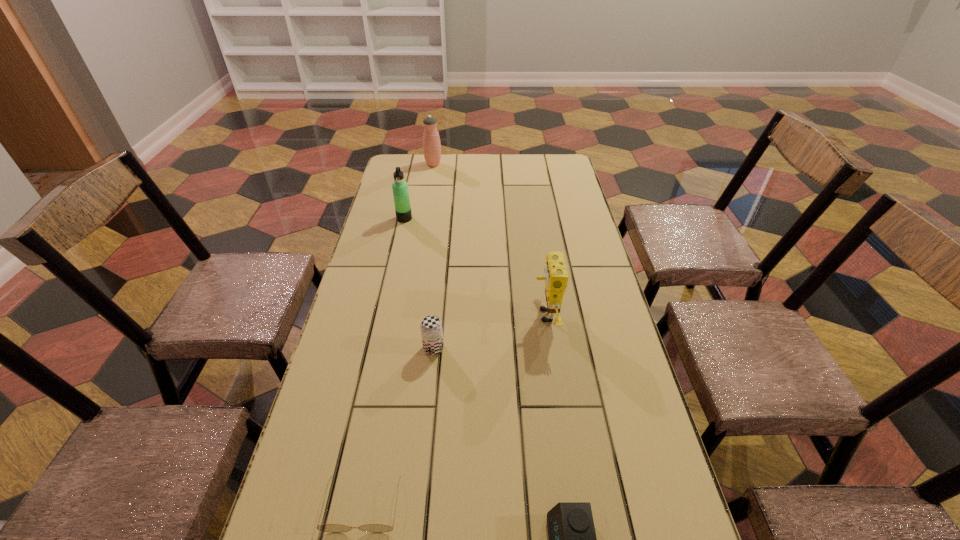
Identify the location of the right thermos bottle. The width and height of the screenshot is (960, 540). click(x=431, y=141).

The height and width of the screenshot is (540, 960). I want to click on the farther thermos bottle, so click(431, 141).

This screenshot has height=540, width=960. Identify the location of the left thermos bottle. (400, 188).

At what (x,y) coordinates should I click in order to perform the action: click on the second farthest object. Please return your answer as a coordinate pair (x, y). Looking at the image, I should click on (400, 188).

Identify the location of sponge. (556, 280).

What are the coordinates of `beer can` in the screenshot? It's located at (431, 326).

Where is `the fourth object from left to right`? This screenshot has width=960, height=540. the fourth object from left to right is located at coordinates (431, 326).

At what (x,y) coordinates should I click in order to perform the action: click on the shortest object. Please return your answer as a coordinate pair (x, y). The image size is (960, 540). Looking at the image, I should click on (332, 528).

Where is `vacant space located 0.170m on the front of the farther thermos bottle`? The height and width of the screenshot is (540, 960). vacant space located 0.170m on the front of the farther thermos bottle is located at coordinates (429, 189).

Find the location of `vacant space positioned on the front of the left thermos bottle`. vacant space positioned on the front of the left thermos bottle is located at coordinates (389, 288).